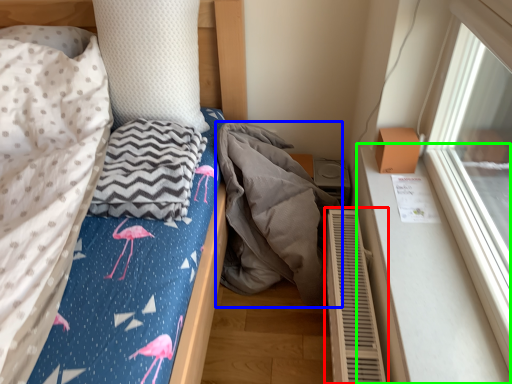
Question: Which object is the closest to the air conditioner (highlighted by a red box)? Choose among these: material (highlighted by a blue box) or window sill (highlighted by a green box).

Choices:
 (A) material
 (B) window sill

Answer: (B)